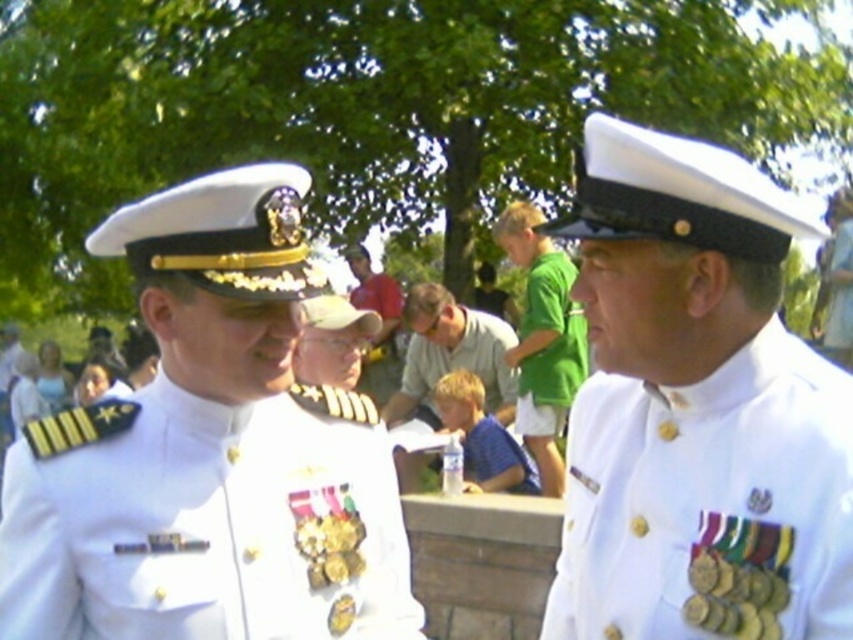
You are a photographer at an event and need to capture a photo of both the white matte uniform at right and the green cotton shirt at center. Based on their sizes, which one should you focus on first to ensure they both fit in the frame?

The white matte uniform at right is smaller than the green cotton shirt at center, so you should focus on the green cotton shirt at center first to ensure both fit in the frame.

You are a photographer setting up a shot of the two individuals in the scene. You need to ensure both the white glossy uniform at center and the green cotton shirt at center are fully visible in the frame. Which uniform should you position closer to the camera to avoid cropping?

The white glossy uniform at center is wider than the green cotton shirt at center, so positioning the white glossy uniform at center closer to the camera will ensure it fits within the frame without cropping.